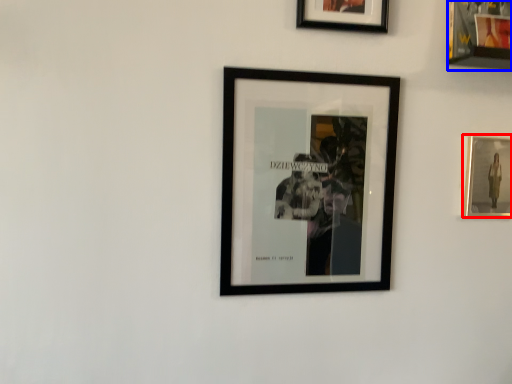
Question: Which object is closer to the camera taking this photo, picture frame (highlighted by a red box) or picture frame (highlighted by a blue box)?

Choices:
 (A) picture frame
 (B) picture frame

Answer: (B)